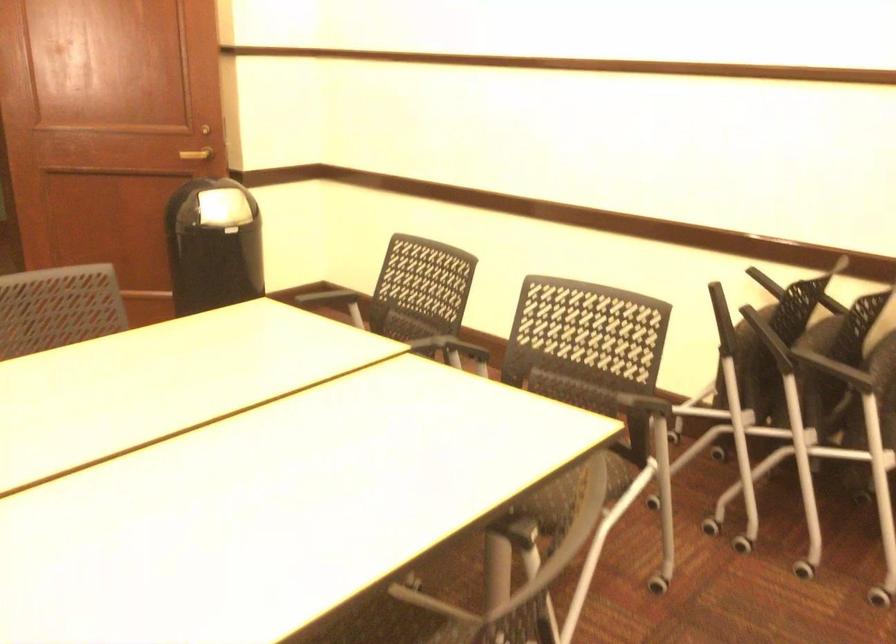
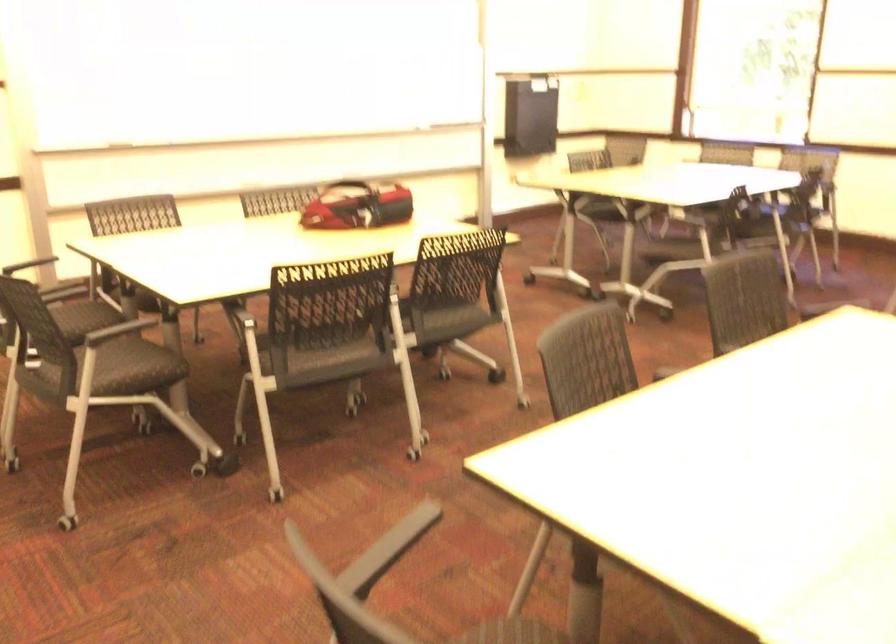
Locate, in the second image, the point that corresponds to point 664,412 in the first image.

(389, 549)